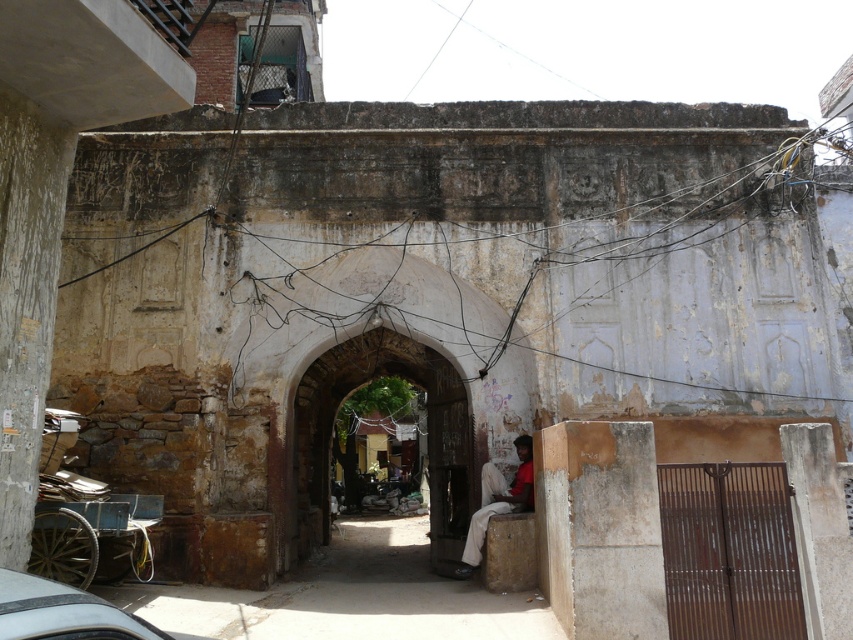
Question: Does black leather car at lower left have a larger size compared to white cotton cloth at center?

Choices:
 (A) yes
 (B) no

Answer: (B)

Question: Which object is farther from the camera taking this photo?

Choices:
 (A) white cotton cloth at center
 (B) rustic concrete alley at center
 (C) black leather car at lower left

Answer: (A)

Question: In this image, where is wooden cart at lower left located relative to black leather car at lower left?

Choices:
 (A) left
 (B) right

Answer: (A)

Question: Does black leather car at lower left appear over white cotton cloth at center?

Choices:
 (A) yes
 (B) no

Answer: (A)

Question: Among these points, which one is farthest from the camera?

Choices:
 (A) (76, 605)
 (B) (44, 516)
 (C) (480, 467)
 (D) (532, 612)

Answer: (C)

Question: Which of the following is the closest to the observer?

Choices:
 (A) black leather car at lower left
 (B) white cotton cloth at center
 (C) rustic concrete alley at center

Answer: (A)